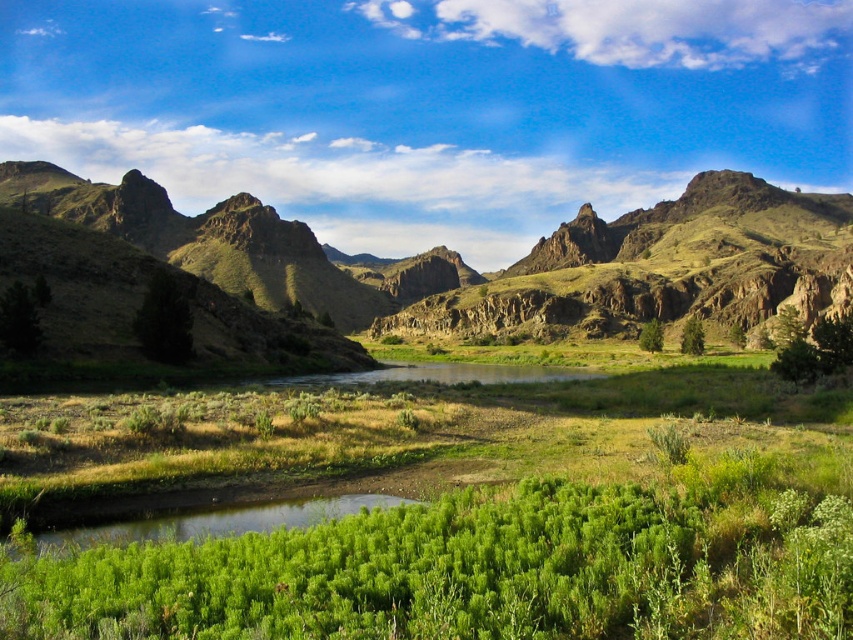
Question: Which of the following is the farthest from the observer?

Choices:
 (A) green leafy shrubs at center
 (B) green rocky mountains at center
 (C) green leafy shrub at center

Answer: (C)

Question: Which of these objects is positioned farthest from the green leafy shrubs at center?

Choices:
 (A) green leafy shrub at center
 (B) green rocky mountains at center

Answer: (B)

Question: Can you confirm if green leafy shrubs at center is positioned below green leafy shrub at center?

Choices:
 (A) no
 (B) yes

Answer: (B)

Question: Does green leafy shrubs at center have a smaller size compared to green rocky mountains at center?

Choices:
 (A) yes
 (B) no

Answer: (A)

Question: Which is nearer to the green rocky mountains at center?

Choices:
 (A) green leafy shrubs at center
 (B) green leafy shrub at center

Answer: (B)

Question: Is green rocky mountains at center further to camera compared to green leafy shrub at center?

Choices:
 (A) yes
 (B) no

Answer: (B)